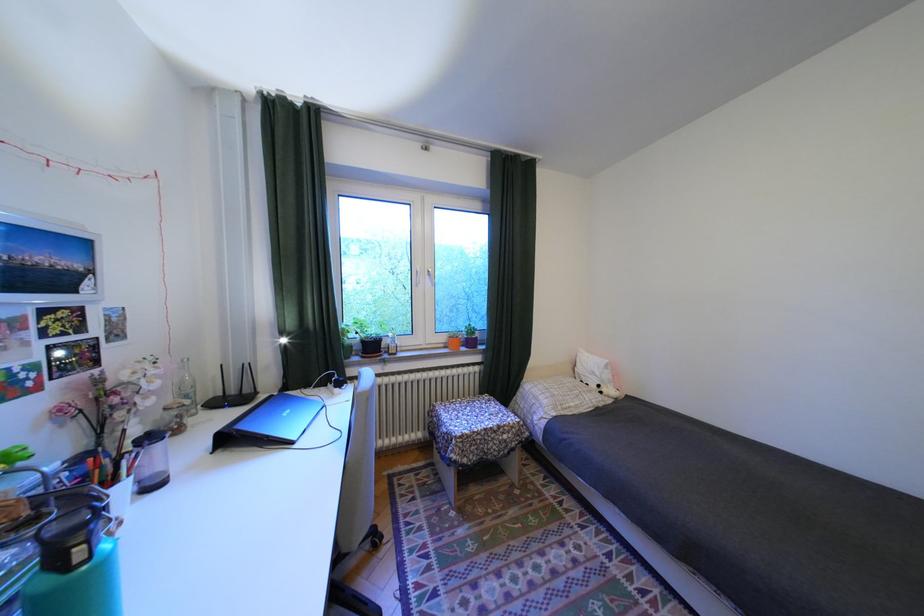
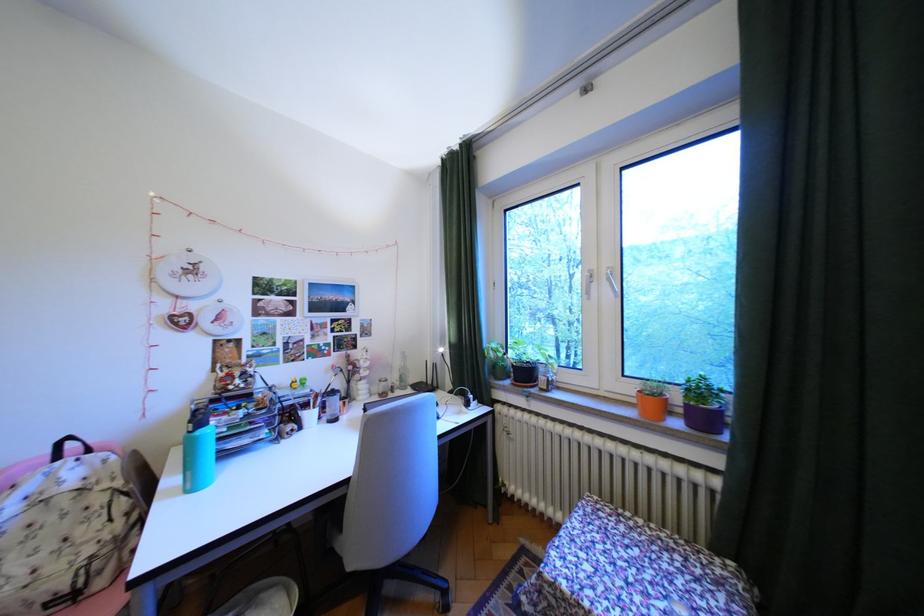
In the second image, find the point that corresponds to pixel 455 339 in the first image.

(641, 390)